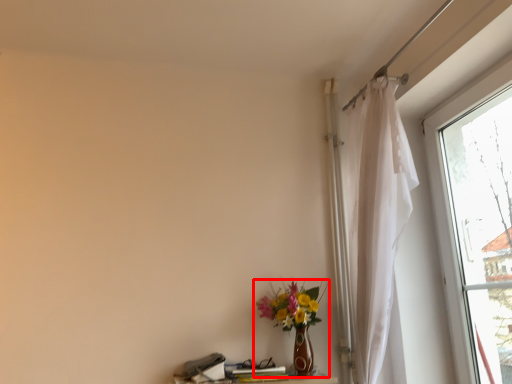
Question: From the image's perspective, considering the relative positions of houseplant (annotated by the red box) and table in the image provided, where is houseplant (annotated by the red box) located with respect to the staircase?

Choices:
 (A) above
 (B) below

Answer: (A)